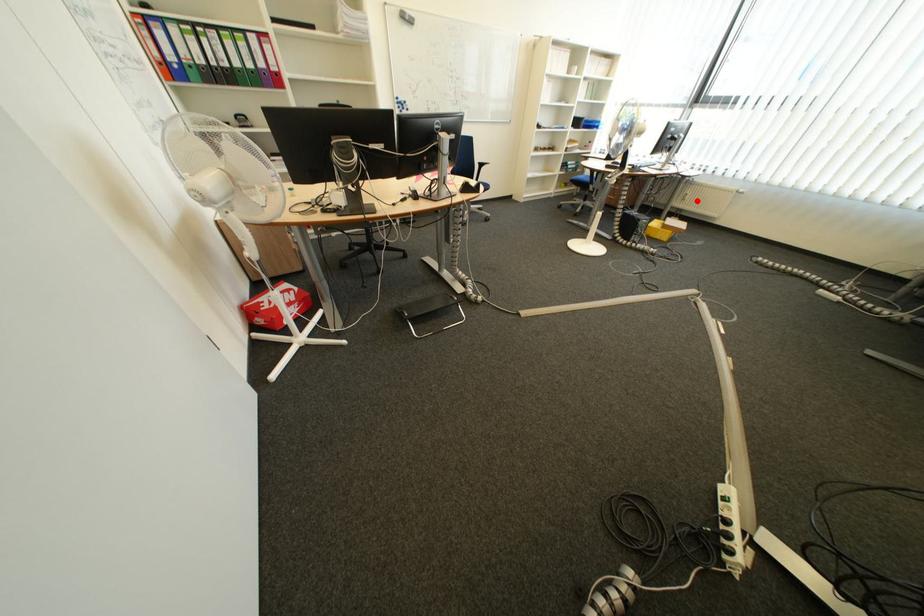
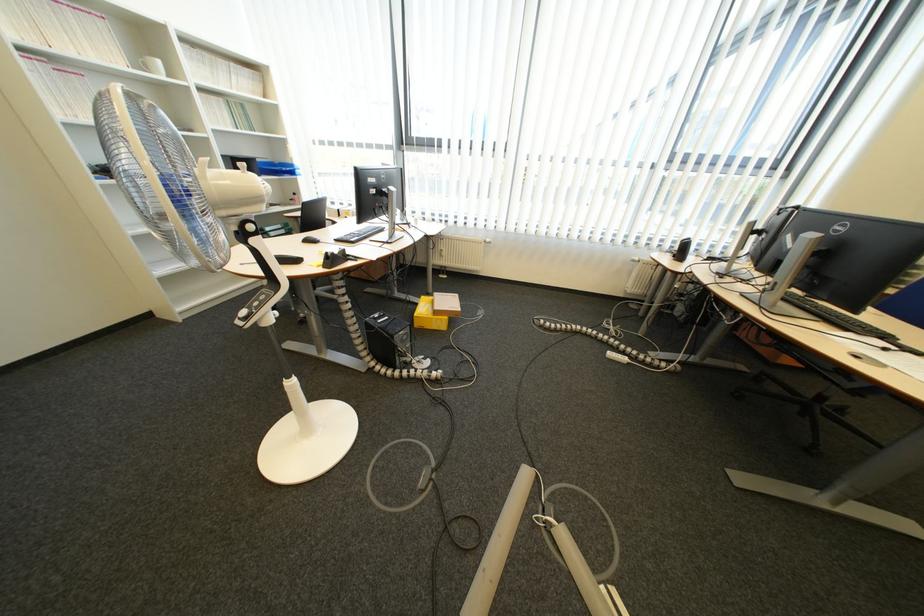
In the second image, find the point that corresponds to the highlighted location in the first image.

(455, 257)